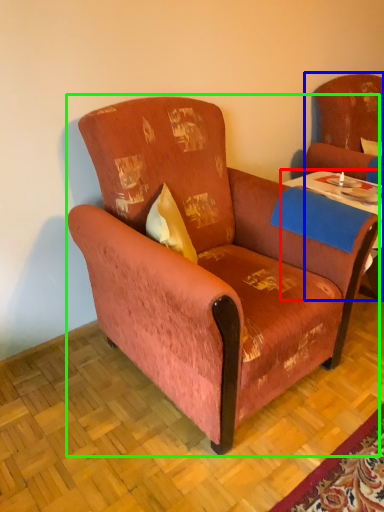
Question: Based on their relative distances, which object is farther from table (highlighted by a red box)? Choose from swivel chair (highlighted by a blue box) and chair (highlighted by a green box).

Choices:
 (A) swivel chair
 (B) chair

Answer: (B)